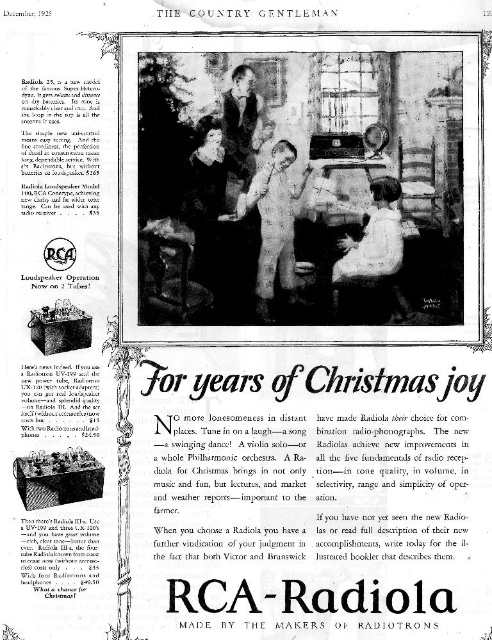
You are standing in the living room scene depicted in the vintage advertisement. There are two points marked in the image. Which point is closer to you, point at (290,288) or point at (222,106)?

Point at (290,288) is further to the viewer than point at (222,106), so the point at (222,106) is closer to you.

Looking at this image, you are a tailor who needs to determine which garment is on top in the image. Which one is above the other between the white cotton shirt at center and the smooth leather jacket at center?

The smooth leather jacket at center is above the white cotton shirt at center because the white cotton shirt at center is positioned under it.